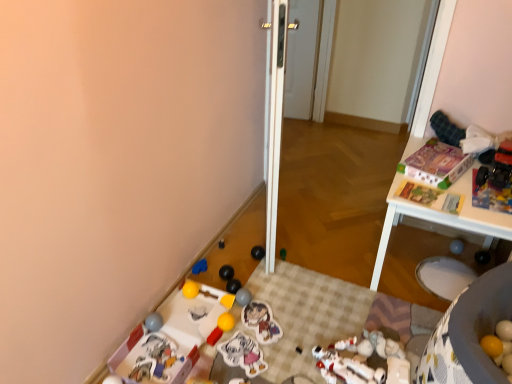
The width and height of the screenshot is (512, 384). I want to click on free space above plastic toy car at lower left, the 2th toy positioned from the left (from a real-world perspective), so click(x=154, y=356).